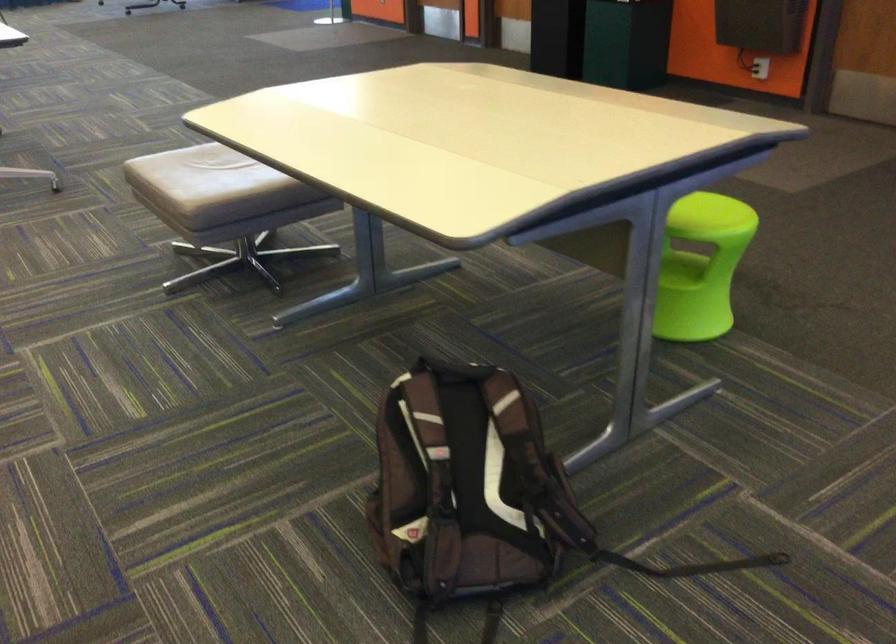
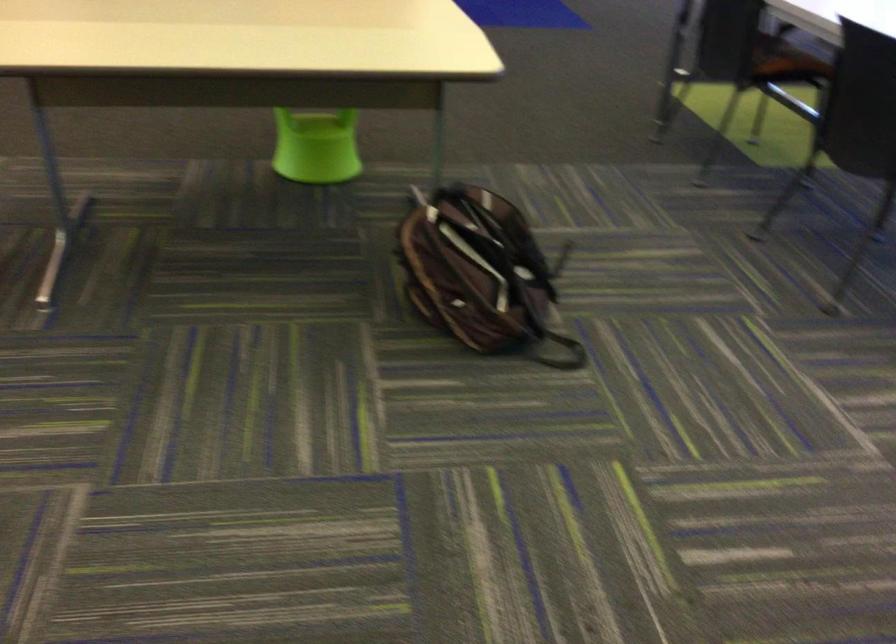
Locate, in the second image, the point that corresponds to pixel 341 178 in the first image.

(322, 67)